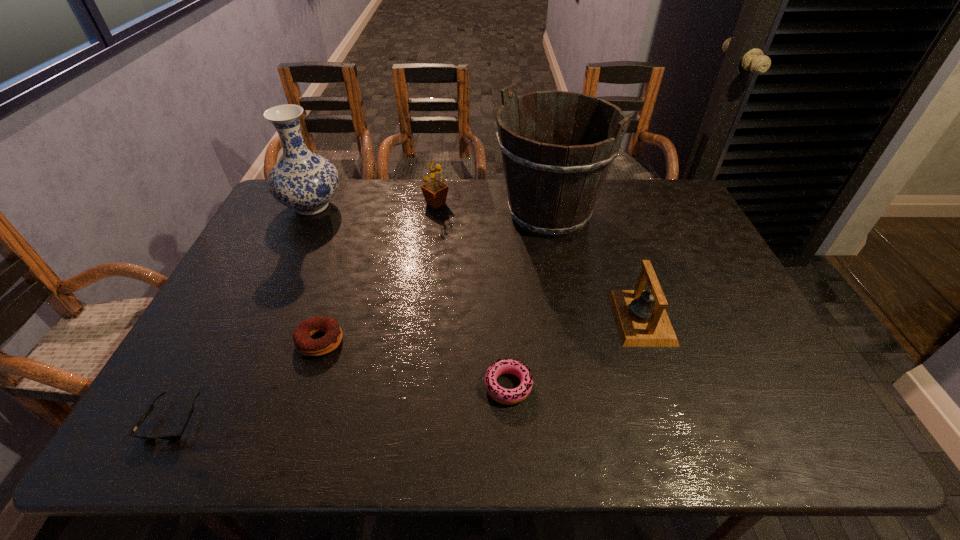
Identify the location of unoccupied position between the bell and the nearer doughnut. (575, 352).

Where is `free space between the fourth object from left to right and the vase`? The image size is (960, 540). free space between the fourth object from left to right and the vase is located at coordinates (374, 205).

This screenshot has width=960, height=540. What are the coordinates of `free space between the fourth tallest object and the sixth tallest object` in the screenshot? It's located at (575, 352).

Find the location of a particular element. The height and width of the screenshot is (540, 960). empty location between the shortest object and the sixth tallest object is located at coordinates (341, 402).

In order to click on unoccupied position between the bucket and the nearer doughnut in this screenshot , I will do `click(529, 300)`.

The image size is (960, 540). Find the location of `vacant space that is in between the bucket and the sunflower`. vacant space that is in between the bucket and the sunflower is located at coordinates (492, 208).

I want to click on unoccupied area between the sunglasses and the nearer doughnut, so click(x=341, y=402).

Image resolution: width=960 pixels, height=540 pixels. I want to click on free spot between the sunglasses and the sixth tallest object, so click(x=341, y=402).

Choose which object is the nearest neighbor to the vase. Please provide its 2D coordinates. Your answer should be formatted as a tuple, i.e. [(x, y)], where the tuple contains the x and y coordinates of a point satisfying the conditions above.

[(435, 192)]

Where is `the fifth closest object relative to the right doughnut`? the fifth closest object relative to the right doughnut is located at coordinates (435, 192).